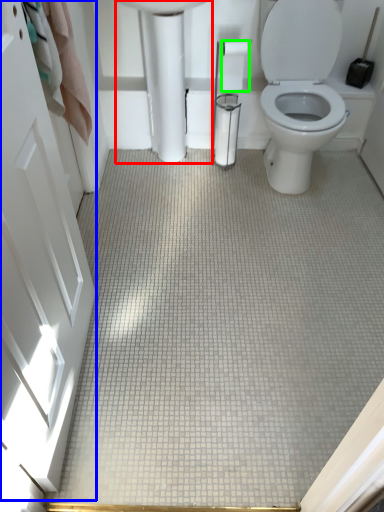
Question: Which object is positioned closest to porcelain (highlighted by a red box)? Select from screen door (highlighted by a blue box) and toilet paper (highlighted by a green box).

Choices:
 (A) screen door
 (B) toilet paper

Answer: (B)